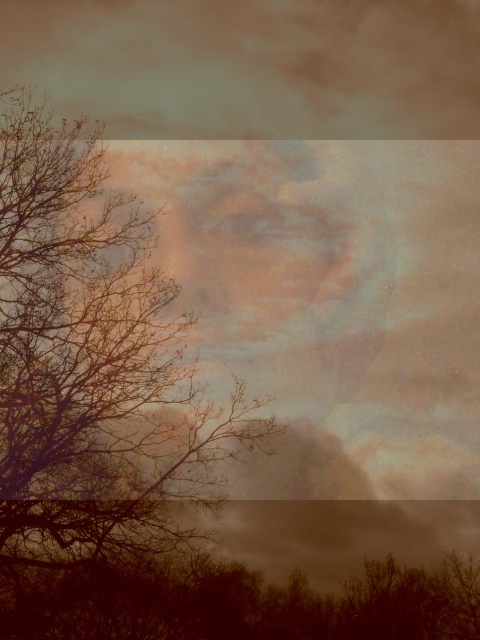
You are an artist trying to paint this scene. You notice the brown leafless branches at left and the brown matte tree at lower center. Which object should you paint first if you follow the rule of painting larger objects before smaller ones?

The brown leafless branches at left should be painted first because it is larger than the brown matte tree at lower center according to the description.

You are an artist trying to paint this scene. You need to decide the order of painting the brown leafless branches at left and the brown matte tree at lower center. Which object should you paint first to ensure proper layering?

The brown leafless branches at left should be painted first because they are positioned over the brown matte tree at lower center, meaning they need to be layered on top to maintain the correct spatial relationship.